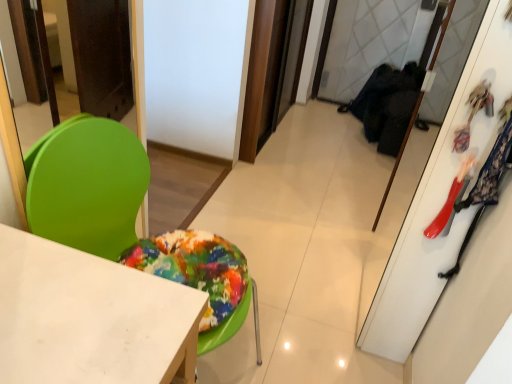
This screenshot has width=512, height=384. What are the coordinates of `green plastic chair at left` in the screenshot? It's located at (105, 56).

What do you see at coordinates (105, 56) in the screenshot? I see `green plastic chair at left` at bounding box center [105, 56].

What is the approximate width of green plastic chair at left?

The width of green plastic chair at left is 1.25 inches.

At what (x,y) coordinates should I click in order to perform the action: click on green plastic chair at left. Please return your answer as a coordinate pair (x, y). Looking at the image, I should click on (105, 56).